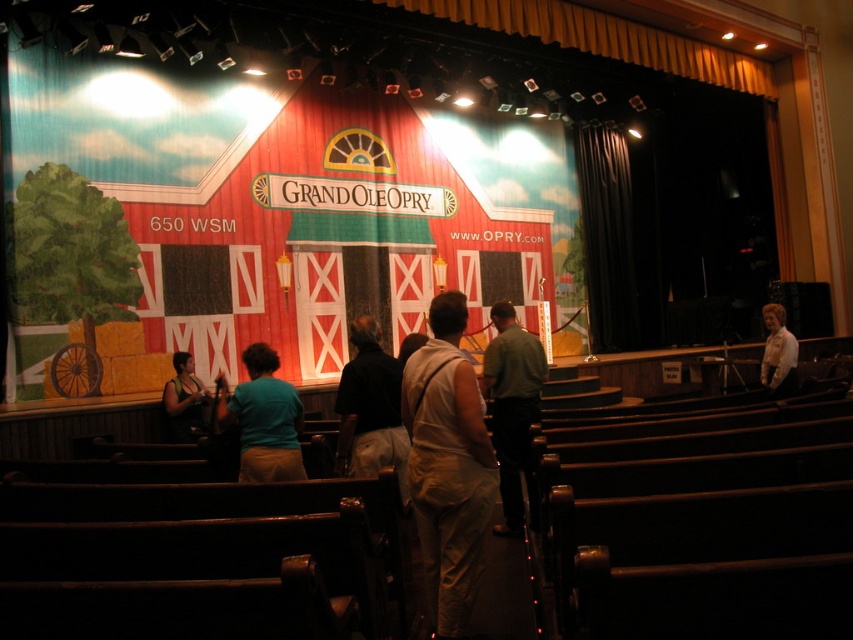
Question: Which point is closer to the camera?

Choices:
 (A) teal fabric shirt at center
 (B) light brown fabric shirt at center
 (C) green fabric shirt at center

Answer: (A)

Question: Which object is positioned farthest from the white shirt at right?

Choices:
 (A) teal fabric shirt at center
 (B) green fabric shirt at center
 (C) beige fabric dress at center
 (D) light brown fabric shirt at center

Answer: (C)

Question: Does green fabric shirt at center have a smaller size compared to white shirt at right?

Choices:
 (A) yes
 (B) no

Answer: (B)

Question: Can you confirm if green fabric shirt at center is positioned below light brown fabric shirt at center?

Choices:
 (A) no
 (B) yes

Answer: (B)

Question: Is black velvet curtain at right below green fabric shirt at center?

Choices:
 (A) yes
 (B) no

Answer: (B)

Question: Which object is positioned closest to the light brown fabric shirt at center?

Choices:
 (A) green fabric shirt at center
 (B) teal fabric shirt at center
 (C) black velvet curtain at right

Answer: (B)